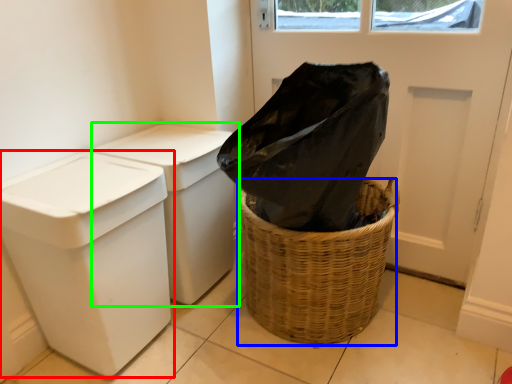
Question: Considering the real-world distances, which object is farthest from waste container (highlighted by a red box)? basket container (highlighted by a blue box) or waste container (highlighted by a green box)?

Choices:
 (A) basket container
 (B) waste container

Answer: (A)